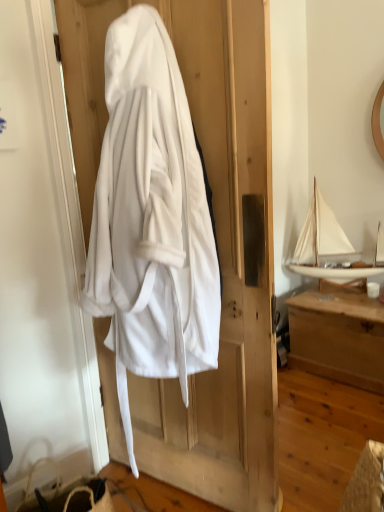
The height and width of the screenshot is (512, 384). What do you see at coordinates (338, 336) in the screenshot?
I see `wooden chest at right` at bounding box center [338, 336].

What do you see at coordinates (43, 266) in the screenshot?
I see `white fabric screen door at left` at bounding box center [43, 266].

Measure the distance between white wooden boat at upper right and camera.

2.54 meters.

Identify the location of white soft robe at center. This screenshot has height=512, width=384. (217, 241).

Where is `wooden chest at right`? The width and height of the screenshot is (384, 512). wooden chest at right is located at coordinates (338, 336).

How distant is white soft robe at center from white fabric screen door at left?

white soft robe at center is 13.43 inches away from white fabric screen door at left.

You are a GUI agent. You are given a task and a screenshot of the screen. Output one action in this format:
    pyautogui.click(x=<x>, y=<y>)
    Task: Click on the door behind the white fabric screen door at left
    
    Given the screenshot: What is the action you would take?
    pyautogui.click(x=217, y=241)

Looking at this image, who is smaller, white soft robe at center or white fabric screen door at left?

white fabric screen door at left is smaller.

Is white soft robe at center located outside white wooden boat at upper right?

Absolutely, white soft robe at center is external to white wooden boat at upper right.

From a real-world perspective, between white soft robe at center and white wooden boat at upper right, who is vertically higher?

white soft robe at center.

The image size is (384, 512). In order to click on door located below the white wooden boat at upper right (from the image's perspective) in this screenshot , I will do `click(217, 241)`.

Who is smaller, white soft robe at center or white wooden boat at upper right?

white wooden boat at upper right is smaller.

Is wooden chest at right at the left side of white fabric screen door at left?

In fact, wooden chest at right is to the right of white fabric screen door at left.

Based on their sizes in the image, would you say wooden chest at right is bigger or smaller than white fabric screen door at left?

Considering their sizes, wooden chest at right takes up more space than white fabric screen door at left.

Image resolution: width=384 pixels, height=512 pixels. In order to click on screen door located in front of the wooden chest at right in this screenshot , I will do pos(43,266).

Which of these two, wooden chest at right or white fabric screen door at left, is wider?

wooden chest at right is wider.

From the image's perspective, who appears lower, white fabric screen door at left or white soft robe at center?

white fabric screen door at left is shown below in the image.

From a real-world perspective, which object stands above the other?

white fabric screen door at left.

Looking at this image, which is more to the right, white fabric screen door at left or white soft robe at center?

Positioned to the right is white soft robe at center.

Is white fabric screen door at left in contact with white soft robe at center?

No.

Can you confirm if white fabric screen door at left is shorter than wooden chest at right?

No.

Who is more distant, white fabric screen door at left or wooden chest at right?

Positioned behind is wooden chest at right.

From the image's perspective, which object appears higher, white fabric screen door at left or wooden chest at right?

From the image's view, white fabric screen door at left is above.

Is white wooden boat at upper right taller than white fabric screen door at left?

No, white wooden boat at upper right is not taller than white fabric screen door at left.

What are the coordinates of `boat lying above the white fabric screen door at left (from the image's perspective)` in the screenshot? It's located at 332,247.

Consider the image. Based on their positions, is white wooden boat at upper right located to the left or right of white fabric screen door at left?

Clearly, white wooden boat at upper right is on the right of white fabric screen door at left in the image.

What's the angular difference between white wooden boat at upper right and white fabric screen door at left's facing directions?

The angle between the facing direction of white wooden boat at upper right and the facing direction of white fabric screen door at left is 179 degrees.

Is white wooden boat at upper right in front of white soft robe at center?

No, white wooden boat at upper right is behind white soft robe at center.

How distant is white wooden boat at upper right from white soft robe at center?

white wooden boat at upper right and white soft robe at center are 4.89 feet apart.

In the scene shown: Who is bigger, white wooden boat at upper right or white soft robe at center?

Bigger between the two is white soft robe at center.

Does white wooden boat at upper right have a greater height compared to white soft robe at center?

In fact, white wooden boat at upper right may be shorter than white soft robe at center.

This screenshot has height=512, width=384. What are the coordinates of `screen door located above the white soft robe at center (from a real-world perspective)` in the screenshot? It's located at (43, 266).

The height and width of the screenshot is (512, 384). Find the location of `boat that is behind the white soft robe at center`. boat that is behind the white soft robe at center is located at coordinates (332, 247).

Consider the image. Looking at the image, which one is located further to white soft robe at center, wooden chest at right or white wooden boat at upper right?

Based on the image, white wooden boat at upper right appears to be further to white soft robe at center.

Which object lies further to the anchor point wooden chest at right, white wooden boat at upper right or white fabric screen door at left?

Among the two, white fabric screen door at left is located further to wooden chest at right.

Estimate the real-world distances between objects in this image. Which object is further from white soft robe at center, white fabric screen door at left or white wooden boat at upper right?

Based on the image, white wooden boat at upper right appears to be further to white soft robe at center.

Based on their spatial positions, is white fabric screen door at left or white soft robe at center further from wooden chest at right?

white fabric screen door at left.

Which object lies further to the anchor point white wooden boat at upper right, white soft robe at center or white fabric screen door at left?

The object further to white wooden boat at upper right is white fabric screen door at left.

From the image, which object appears to be farther from white wooden boat at upper right, wooden chest at right or white soft robe at center?

Based on the image, white soft robe at center appears to be further to white wooden boat at upper right.

When comparing their distances from white wooden boat at upper right, does wooden chest at right or white fabric screen door at left seem closer?

wooden chest at right is closer to white wooden boat at upper right.

Which object lies nearer to the anchor point white fabric screen door at left, wooden chest at right or white wooden boat at upper right?

The object closer to white fabric screen door at left is wooden chest at right.

At what (x,y) coordinates should I click in order to perform the action: click on furniture between white soft robe at center and white wooden boat at upper right from front to back. Please return your answer as a coordinate pair (x, y). The width and height of the screenshot is (384, 512). Looking at the image, I should click on (338, 336).

The height and width of the screenshot is (512, 384). Identify the location of door between white fabric screen door at left and white wooden boat at upper right from front to back. (217, 241).

What are the coordinates of `boat located between white fabric screen door at left and wooden chest at right in the left-right direction` in the screenshot? It's located at (332, 247).

Locate an element on the screen. door between white fabric screen door at left and wooden chest at right from left to right is located at coordinates (217, 241).